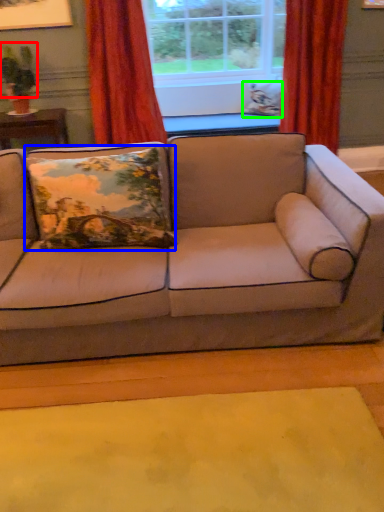
Question: Which object is positioned farthest from plant (highlighted by a red box)? Select from pillow (highlighted by a blue box) and pillow (highlighted by a green box).

Choices:
 (A) pillow
 (B) pillow

Answer: (B)